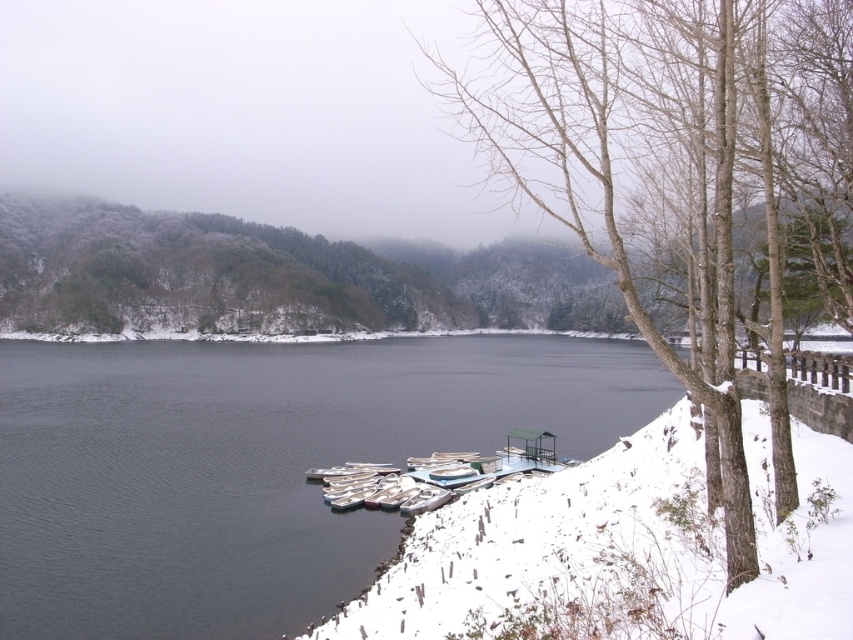
Is bare wood tree at right wider than white matte boats at lower center?

Correct, the width of bare wood tree at right exceeds that of white matte boats at lower center.

Is point (519, 106) in front of point (440, 477)?

Yes, it is.

Image resolution: width=853 pixels, height=640 pixels. What are the coordinates of `bare wood tree at right` in the screenshot? It's located at (610, 192).

Between dark water at center and white matte boats at lower center, which one is positioned higher?

dark water at center is above.

Is dark water at center to the left of white matte boats at lower center from the viewer's perspective?

Yes, dark water at center is to the left of white matte boats at lower center.

Does point (155, 493) come behind point (445, 493)?

That is True.

This screenshot has height=640, width=853. Identify the location of dark water at center. (242, 454).

What do you see at coordinates (242, 454) in the screenshot? I see `dark water at center` at bounding box center [242, 454].

How distant is dark water at center from bare wood tree at right?

They are 187.84 feet apart.

Where is `dark water at center`? dark water at center is located at coordinates (242, 454).

Identify the location of dark water at center. The height and width of the screenshot is (640, 853). (242, 454).